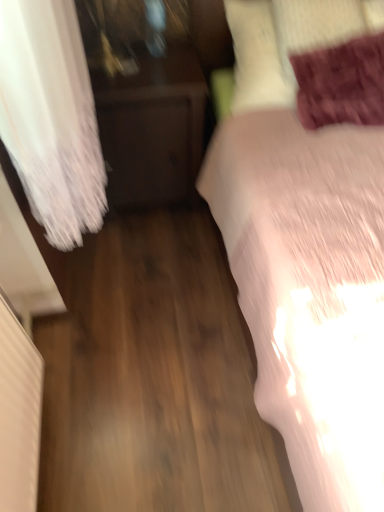
Question: Looking at their shapes, would you say white soft bed at right is wider or thinner than velvet purple pillow at upper right?

Choices:
 (A) wide
 (B) thin

Answer: (A)

Question: Looking at the image, does white soft bed at right seem bigger or smaller compared to velvet purple pillow at upper right?

Choices:
 (A) small
 (B) big

Answer: (B)

Question: Which of these objects is positioned farthest from the velvet purple pillow at upper right?

Choices:
 (A) dark wood nightstand at left
 (B) white soft bed at right

Answer: (A)

Question: Estimate the real-world distances between objects in this image. Which object is closer to the velvet purple pillow at upper right?

Choices:
 (A) white soft bed at right
 (B) dark wood nightstand at left

Answer: (A)